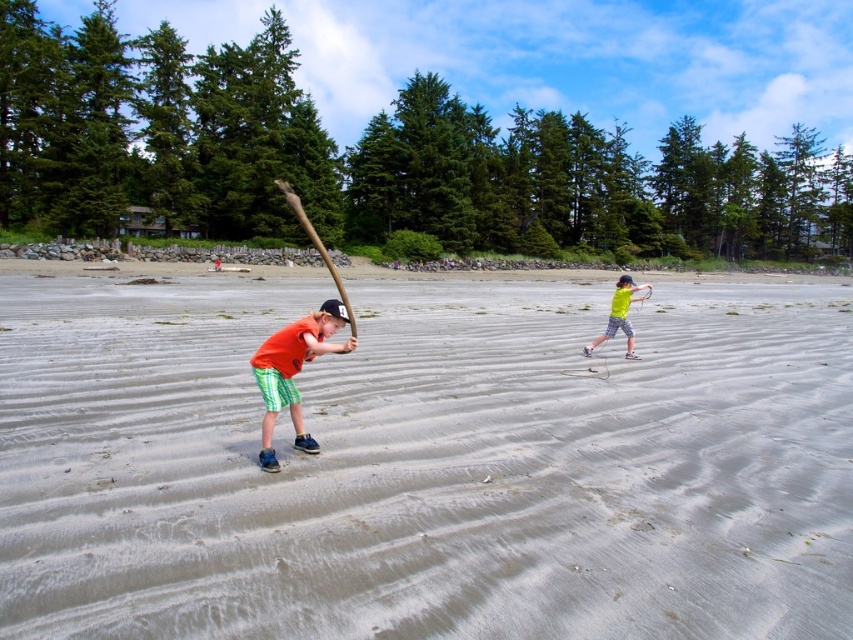
Does smooth sand at center have a lesser height compared to neon yellow t-shirt at right?

Indeed, smooth sand at center has a lesser height compared to neon yellow t-shirt at right.

Is point (666, 522) less distant than point (624, 289)?

Yes.

Locate an element on the screen. Image resolution: width=853 pixels, height=640 pixels. smooth sand at center is located at coordinates (426, 465).

Find the location of `neon yellow t-shirt at right`. neon yellow t-shirt at right is located at coordinates (619, 314).

At what (x,y) coordinates should I click in order to perform the action: click on neon yellow t-shirt at right. Please return your answer as a coordinate pair (x, y). This screenshot has height=640, width=853. Looking at the image, I should click on (619, 314).

The image size is (853, 640). Find the location of `neon yellow t-shirt at right`. neon yellow t-shirt at right is located at coordinates (619, 314).

The height and width of the screenshot is (640, 853). What do you see at coordinates (426, 465) in the screenshot? I see `smooth sand at center` at bounding box center [426, 465].

Can you confirm if smooth sand at center is shorter than orange cotton shirt at center?

In fact, smooth sand at center may be taller than orange cotton shirt at center.

Between point (112, 472) and point (316, 316), which one is positioned behind?

The point (316, 316) is behind.

This screenshot has height=640, width=853. In order to click on smooth sand at center in this screenshot , I will do `click(426, 465)`.